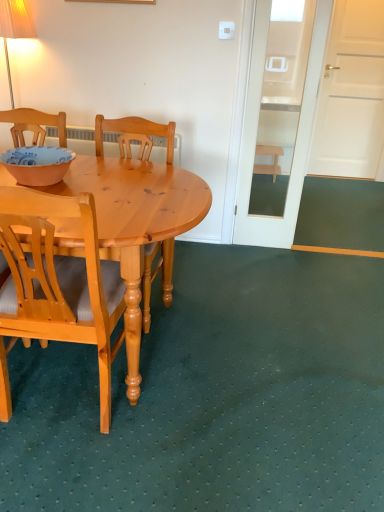
Question: Is wooden stool at right spatially inside light wood chair at center, which ranks as the first chair in back-to-front order, or outside of it?

Choices:
 (A) outside
 (B) inside

Answer: (A)

Question: Is point (276, 155) positioned closer to the camera than point (148, 271)?

Choices:
 (A) farther
 (B) closer

Answer: (A)

Question: Estimate the real-world distances between objects in this image. Which object is farther from the light brown wood chair at left, which is counted as the second chair, starting from the back?

Choices:
 (A) light wood chair at center, which is the second chair from front to back
 (B) wooden stool at right
 (C) matte orange bowl at left

Answer: (B)

Question: Considering the real-world distances, which object is closest to the light brown wood chair at left, which is counted as the second chair, starting from the back?

Choices:
 (A) wooden stool at right
 (B) light wood chair at center, which ranks as the first chair in back-to-front order
 (C) matte orange bowl at left

Answer: (C)